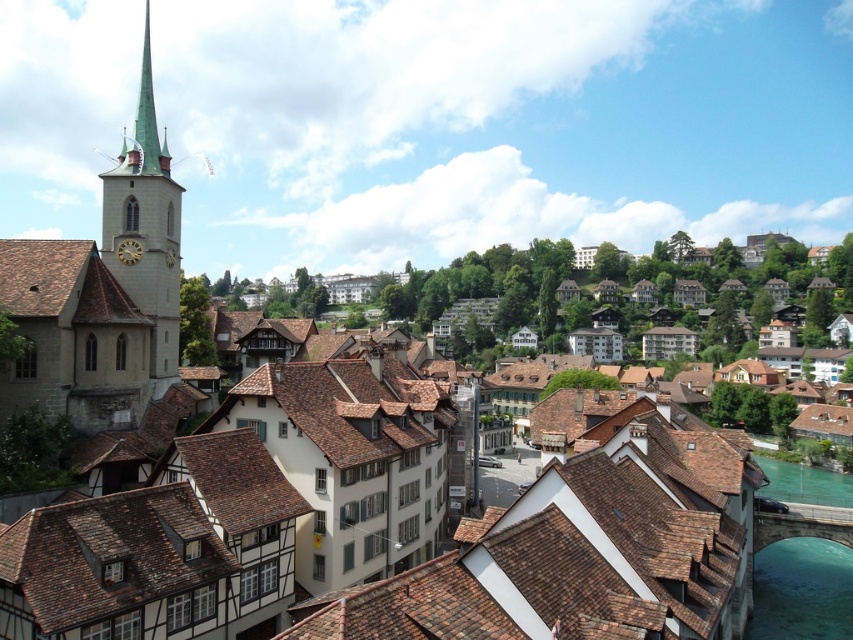
You are standing at the point marked by the coordinates point (583,550) in the image. What object are you standing on?

The point (583,550) marks the brown tile roof at center.

You are a tourist standing in the historic town square and want to take a photo of the brown tile roof at center and the clear blue water at lower right. Which object should you point your camera towards first if you want to capture both in a single frame without moving the camera?

You should point your camera towards the brown tile roof at center first because it is to the left of the clear blue water at lower right, so capturing the left side first will include both objects in the frame.